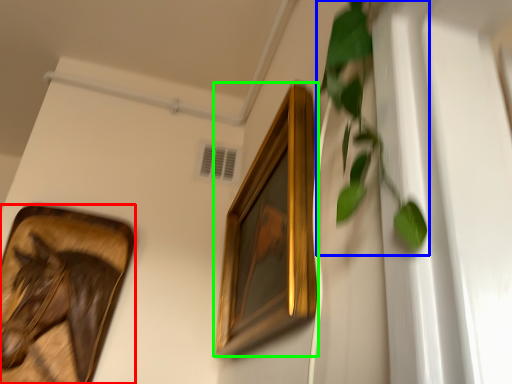
Question: Based on their relative distances, which object is nearer to picture frame (highlighted by a red box)? Choose from vegetation (highlighted by a blue box) and picture frame (highlighted by a green box).

Choices:
 (A) vegetation
 (B) picture frame

Answer: (B)